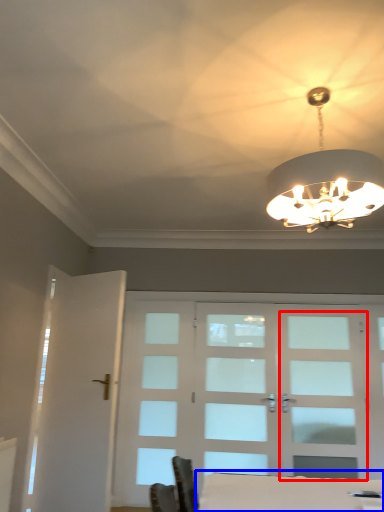
Question: Which object appears farthest to the camera in this image, screen door (highlighted by a red box) or table (highlighted by a blue box)?

Choices:
 (A) screen door
 (B) table

Answer: (A)